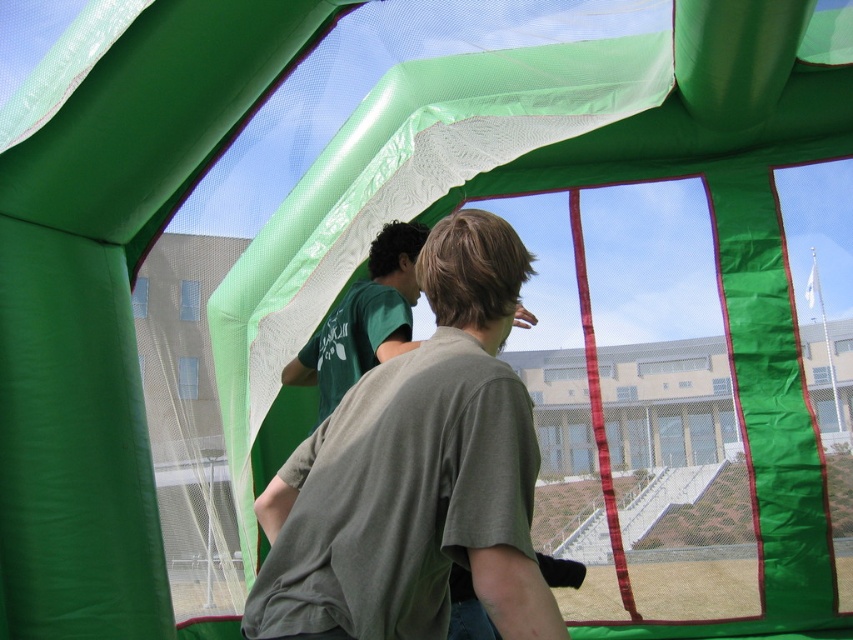
Question: Which point is farther to the camera?

Choices:
 (A) (357, 362)
 (B) (282, 520)

Answer: (A)

Question: Among these objects, which one is farthest from the camera?

Choices:
 (A) green matte t-shirt at center
 (B) green matte t-shirt at upper left

Answer: (B)

Question: Is green matte t-shirt at center above green matte t-shirt at upper left?

Choices:
 (A) yes
 (B) no

Answer: (B)

Question: Is green matte t-shirt at center to the right of green matte t-shirt at upper left from the viewer's perspective?

Choices:
 (A) yes
 (B) no

Answer: (A)

Question: Is the position of green matte t-shirt at center more distant than that of green matte t-shirt at upper left?

Choices:
 (A) no
 (B) yes

Answer: (A)

Question: Among these points, which one is farthest from the camera?

Choices:
 (A) (384, 349)
 (B) (384, 570)

Answer: (A)